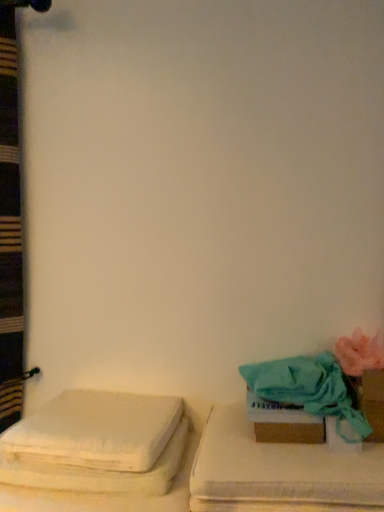
The height and width of the screenshot is (512, 384). Find the location of `white fabric cushion at left, arranged as the first furniture when viewed from the left`. white fabric cushion at left, arranged as the first furniture when viewed from the left is located at coordinates (100, 455).

This screenshot has height=512, width=384. I want to click on white fabric cushion at left, the 2th furniture positioned from the right, so click(100, 455).

Can you tell me how much brown cardboard box at lower right and teal fabric cushion at right, which is the second furniture from left to right, differ in facing direction?

The angle between the facing direction of brown cardboard box at lower right and the facing direction of teal fabric cushion at right, which is the second furniture from left to right, is 4.98 degrees.

Based on the photo, which is less distant, (286, 439) or (305, 471)?

Point (305, 471)

From a real-world perspective, is brown cardboard box at lower right over teal fabric cushion at right, which is the second furniture from left to right?

Yes, from a real-world perspective, brown cardboard box at lower right is above teal fabric cushion at right, which is the second furniture from left to right.

Consider the image. Can you confirm if brown cardboard box at lower right is taller than teal fabric cushion at right, which is the 1th furniture in right-to-left order?

Incorrect, the height of brown cardboard box at lower right is not larger of that of teal fabric cushion at right, which is the 1th furniture in right-to-left order.

Looking at this image, is brown cardboard box at lower right next to white fabric cushion at left, the 2th furniture positioned from the right, and touching it?

No, brown cardboard box at lower right is not making contact with white fabric cushion at left, the 2th furniture positioned from the right.

From the image's perspective, between brown cardboard box at lower right and white fabric cushion at left, arranged as the first furniture when viewed from the left, who is located below?

white fabric cushion at left, arranged as the first furniture when viewed from the left, from the image's perspective.

Could you tell me if brown cardboard box at lower right is turned towards white fabric cushion at left, arranged as the first furniture when viewed from the left?

No, brown cardboard box at lower right is not facing towards white fabric cushion at left, arranged as the first furniture when viewed from the left.

From a real-world perspective, is brown cardboard box at lower right physically below white fabric cushion at left, arranged as the first furniture when viewed from the left?

No, from a real-world perspective, brown cardboard box at lower right is not under white fabric cushion at left, arranged as the first furniture when viewed from the left.

From a real-world perspective, is brown cardboard box at lower right located beneath pink fabric flower at right?

Yes.

From the image's perspective, is brown cardboard box at lower right above pink fabric flower at right?

Incorrect, from the image's perspective, brown cardboard box at lower right is lower than pink fabric flower at right.

Is brown cardboard box at lower right bigger than pink fabric flower at right?

Actually, brown cardboard box at lower right might be smaller than pink fabric flower at right.

Considering the relative positions of brown cardboard box at lower right and pink fabric flower at right in the image provided, is brown cardboard box at lower right in front of pink fabric flower at right?

No, it is not.

Is brown cardboard box at lower right at the back of white fabric cushion at left, arranged as the first furniture when viewed from the left?

No, white fabric cushion at left, arranged as the first furniture when viewed from the left,'s orientation is not away from brown cardboard box at lower right.

From the image's perspective, which object appears higher, white fabric cushion at left, arranged as the first furniture when viewed from the left, or brown cardboard box at lower right?

brown cardboard box at lower right, from the image's perspective.

Considering the relative sizes of white fabric cushion at left, arranged as the first furniture when viewed from the left, and brown cardboard box at lower right in the image provided, is white fabric cushion at left, arranged as the first furniture when viewed from the left, thinner than brown cardboard box at lower right?

No.

Who is taller, white fabric cushion at left, arranged as the first furniture when viewed from the left, or brown cardboard box at lower right?

Standing taller between the two is white fabric cushion at left, arranged as the first furniture when viewed from the left.

From the image's perspective, does white fabric cushion at left, the 2th furniture positioned from the right, appear higher than teal fabric cushion at right, which is the 1th furniture in right-to-left order?

Incorrect, from the image's perspective, white fabric cushion at left, the 2th furniture positioned from the right, is lower than teal fabric cushion at right, which is the 1th furniture in right-to-left order.

Is teal fabric cushion at right, which is the second furniture from left to right, surrounded by white fabric cushion at left, the 2th furniture positioned from the right?

Definitely not — teal fabric cushion at right, which is the second furniture from left to right, is not inside white fabric cushion at left, the 2th furniture positioned from the right.

I want to click on furniture positioned vertically above the white fabric cushion at left, the 2th furniture positioned from the right (from a real-world perspective), so click(x=279, y=472).

Considering the relative sizes of white fabric cushion at left, arranged as the first furniture when viewed from the left, and teal fabric cushion at right, which is the second furniture from left to right, in the image provided, is white fabric cushion at left, arranged as the first furniture when viewed from the left, wider than teal fabric cushion at right, which is the second furniture from left to right,?

Yes.

From a real-world perspective, between teal fabric towel at lower right and teal fabric cushion at right, which is the 1th furniture in right-to-left order, who is vertically higher?

teal fabric towel at lower right is physically above.

Is teal fabric towel at lower right positioned far away from teal fabric cushion at right, which is the 1th furniture in right-to-left order?

No.

Is teal fabric towel at lower right inside or outside of teal fabric cushion at right, which is the second furniture from left to right?

teal fabric towel at lower right lies outside teal fabric cushion at right, which is the second furniture from left to right.

Which object is wider, teal fabric towel at lower right or teal fabric cushion at right, which is the 1th furniture in right-to-left order?

Wider between the two is teal fabric cushion at right, which is the 1th furniture in right-to-left order.

Who is smaller, teal fabric towel at lower right or white fabric cushion at left, the 2th furniture positioned from the right?

With smaller size is teal fabric towel at lower right.

Can you tell me how much teal fabric towel at lower right and white fabric cushion at left, arranged as the first furniture when viewed from the left, differ in facing direction?

They differ by 3.86 degrees in their facing directions.

Considering the sizes of teal fabric towel at lower right and white fabric cushion at left, arranged as the first furniture when viewed from the left, in the image, is teal fabric towel at lower right taller or shorter than white fabric cushion at left, arranged as the first furniture when viewed from the left,?

teal fabric towel at lower right is taller than white fabric cushion at left, arranged as the first furniture when viewed from the left.

Which is more to the right, teal fabric towel at lower right or white fabric cushion at left, arranged as the first furniture when viewed from the left?

From the viewer's perspective, teal fabric towel at lower right appears more on the right side.

This screenshot has height=512, width=384. Identify the location of the 1st furniture positioned below the brown cardboard box at lower right (from a real-world perspective). (279, 472).

Identify the location of furniture on the left of brown cardboard box at lower right. (100, 455).

Which object lies further to the anchor point brown cardboard box at lower right, white fabric cushion at left, arranged as the first furniture when viewed from the left, or pink fabric flower at right?

white fabric cushion at left, arranged as the first furniture when viewed from the left, is further to brown cardboard box at lower right.

From the image, which object appears to be nearer to white fabric cushion at left, arranged as the first furniture when viewed from the left, teal fabric towel at lower right or brown cardboard box at lower right?

Among the two, brown cardboard box at lower right is located nearer to white fabric cushion at left, arranged as the first furniture when viewed from the left.

Estimate the real-world distances between objects in this image. Which object is closer to white fabric cushion at left, arranged as the first furniture when viewed from the left, brown cardboard box at lower right or pink fabric flower at right?

The object closer to white fabric cushion at left, arranged as the first furniture when viewed from the left, is brown cardboard box at lower right.

From the image, which object appears to be nearer to teal fabric towel at lower right, teal fabric cushion at right, which is the 1th furniture in right-to-left order, or pink fabric flower at right?

The object closer to teal fabric towel at lower right is pink fabric flower at right.

Looking at the image, which one is located closer to teal fabric cushion at right, which is the 1th furniture in right-to-left order, brown cardboard box at lower right or teal fabric towel at lower right?

The object closer to teal fabric cushion at right, which is the 1th furniture in right-to-left order, is brown cardboard box at lower right.

When comparing their distances from white fabric cushion at left, arranged as the first furniture when viewed from the left, does teal fabric cushion at right, which is the second furniture from left to right, or teal fabric towel at lower right seem further?

Among the two, teal fabric towel at lower right is located further to white fabric cushion at left, arranged as the first furniture when viewed from the left.

Looking at the image, which one is located closer to teal fabric towel at lower right, white fabric cushion at left, the 2th furniture positioned from the right, or brown cardboard box at lower right?

brown cardboard box at lower right is closer to teal fabric towel at lower right.

When comparing their distances from brown cardboard box at lower right, does pink fabric flower at right or teal fabric cushion at right, which is the 1th furniture in right-to-left order, seem further?

pink fabric flower at right is further to brown cardboard box at lower right.

Find the location of a particular element. furniture between white fabric cushion at left, the 2th furniture positioned from the right, and pink fabric flower at right is located at coordinates (279, 472).

The image size is (384, 512). What are the coordinates of `furniture between white fabric cushion at left, arranged as the first furniture when viewed from the left, and teal fabric towel at lower right from left to right` in the screenshot? It's located at (279, 472).

At what (x,y) coordinates should I click in order to perform the action: click on furniture between brown cardboard box at lower right and pink fabric flower at right from left to right. Please return your answer as a coordinate pair (x, y). The image size is (384, 512). Looking at the image, I should click on (279, 472).

Locate an element on the screen. The width and height of the screenshot is (384, 512). box between white fabric cushion at left, the 2th furniture positioned from the right, and pink fabric flower at right is located at coordinates (283, 422).